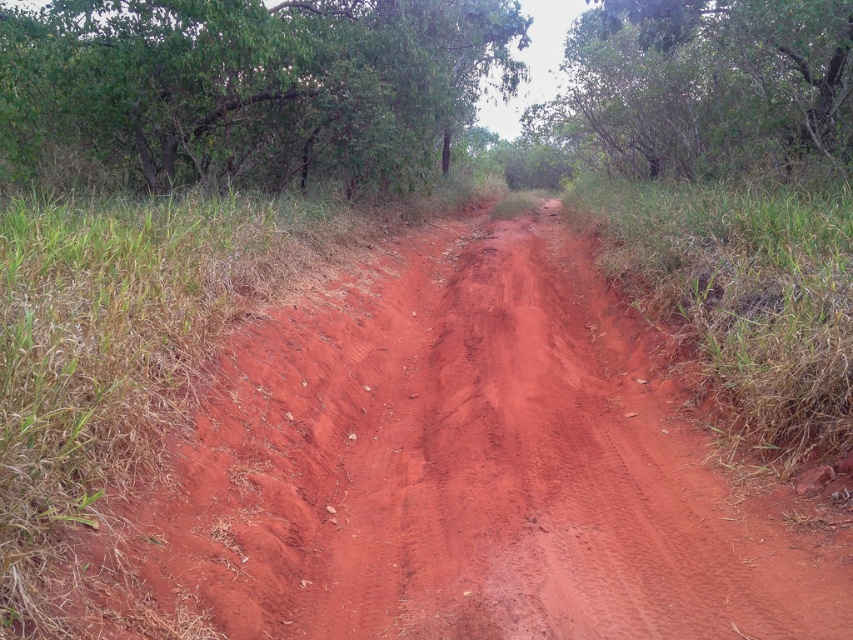
Question: Among these objects, which one is nearest to the camera?

Choices:
 (A) dusty red dirt track at center
 (B) green leafy tree at upper center

Answer: (A)

Question: Is dusty red dirt track at center further to the viewer compared to green leafy tree at upper left?

Choices:
 (A) yes
 (B) no

Answer: (B)

Question: Can you confirm if dusty red dirt track at center is smaller than green leafy tree at upper left?

Choices:
 (A) no
 (B) yes

Answer: (B)

Question: Estimate the real-world distances between objects in this image. Which object is farther from the green leafy tree at upper left?

Choices:
 (A) dusty red dirt track at center
 (B) green leafy tree at upper center

Answer: (A)

Question: From the image, what is the correct spatial relationship of dusty red dirt track at center in relation to green leafy tree at upper left?

Choices:
 (A) left
 (B) right

Answer: (B)

Question: Which point is farther to the camera?

Choices:
 (A) green leafy tree at upper center
 (B) green leafy tree at upper left
 (C) dusty red dirt track at center

Answer: (B)